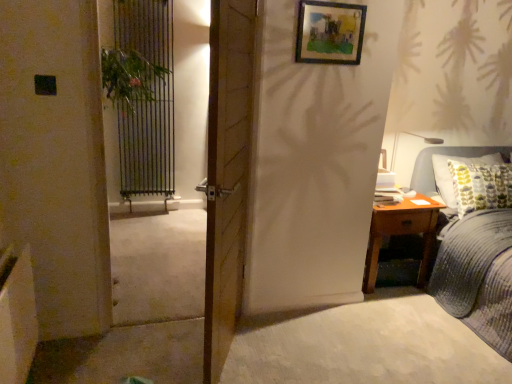
Question: Should I look upward or downward to see blue corduroy bed at right?

Choices:
 (A) down
 (B) up

Answer: (A)

Question: Can you confirm if wooden door at center is taller than green leafy plant at left?

Choices:
 (A) no
 (B) yes

Answer: (B)

Question: Could you tell me if wooden door at center is facing green leafy plant at left?

Choices:
 (A) no
 (B) yes

Answer: (A)

Question: Can you confirm if wooden door at center is bigger than green leafy plant at left?

Choices:
 (A) yes
 (B) no

Answer: (A)

Question: Would you say wooden door at center is a long distance from green leafy plant at left?

Choices:
 (A) yes
 (B) no

Answer: (B)

Question: Is green leafy plant at left completely or partially inside wooden door at center?

Choices:
 (A) no
 (B) yes

Answer: (A)

Question: Can you confirm if wooden door at center is positioned to the left of green leafy plant at left?

Choices:
 (A) yes
 (B) no

Answer: (B)

Question: Is brown wooden nightstand at right shorter than green leafy plant at left?

Choices:
 (A) no
 (B) yes

Answer: (A)

Question: From a real-world perspective, is brown wooden nightstand at right positioned over green leafy plant at left based on gravity?

Choices:
 (A) yes
 (B) no

Answer: (B)

Question: Could you tell me if brown wooden nightstand at right is turned towards green leafy plant at left?

Choices:
 (A) yes
 (B) no

Answer: (B)

Question: Can you confirm if brown wooden nightstand at right is wider than green leafy plant at left?

Choices:
 (A) no
 (B) yes

Answer: (B)

Question: From the image's perspective, is brown wooden nightstand at right below green leafy plant at left?

Choices:
 (A) no
 (B) yes

Answer: (B)

Question: Is the position of brown wooden nightstand at right more distant than that of green leafy plant at left?

Choices:
 (A) no
 (B) yes

Answer: (B)

Question: Would you say blue corduroy bed at right is a long distance from green leafy plant at left?

Choices:
 (A) yes
 (B) no

Answer: (A)